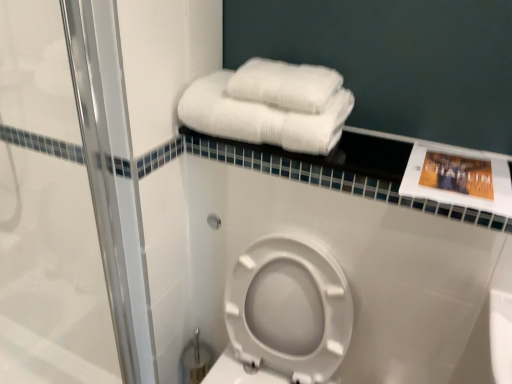
Question: Considering their positions, is white fluffy towels at upper right, the 2th towel when ordered from top to bottom, located in front of or behind white fluffy towels at upper center, which appears as the second towel when ordered from the bottom?

Choices:
 (A) behind
 (B) front

Answer: (B)

Question: Looking at their shapes, would you say white fluffy towels at upper right, the 2th towel when ordered from top to bottom, is wider or thinner than white fluffy towels at upper center, which ranks as the 1th towel in top-to-bottom order?

Choices:
 (A) thin
 (B) wide

Answer: (B)

Question: Estimate the real-world distances between objects in this image. Which object is closer to the white fluffy towels at upper center, which appears as the second towel when ordered from the bottom?

Choices:
 (A) white glossy towel rack at upper center
 (B) white fluffy towels at upper right, which is counted as the 1th towel, starting from the bottom
 (C) clear glass shower door at left
 (D) white plastic toilet at lower center

Answer: (B)

Question: Considering the real-world distances, which object is farthest from the clear glass shower door at left?

Choices:
 (A) white fluffy towels at upper right, the 2th towel when ordered from top to bottom
 (B) white plastic toilet at lower center
 (C) white glossy towel rack at upper center
 (D) white fluffy towels at upper center, which appears as the second towel when ordered from the bottom

Answer: (D)